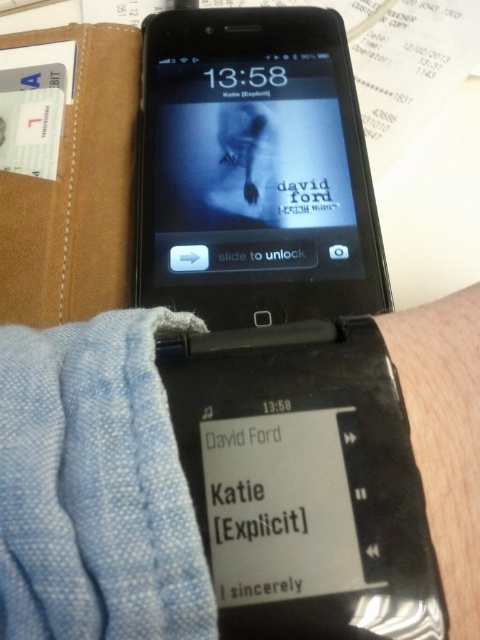
You are holding a black glossy smartphone at center and want to place it on a table next to a skinny silver bracelet at lower right. If the table is only 12 inches wide, will both items fit side by side without overlapping?

The black glossy smartphone at center and the skinny silver bracelet at lower right are 11.88 inches apart, so they can fit side by side on a 12 inch wide table since the total space needed is less than the table width.

You are holding a black glossy smartphone at center and want to place it next to a skinny silver bracelet at lower right on a small shelf. Given that the shelf has limited vertical space, will the smartphone fit vertically without overlapping the bracelet?

The black glossy smartphone at center is taller than the skinny silver bracelet at lower right, so it may not fit vertically on the shelf without overlapping if the shelf height is constrained.

You are holding the flip phone and want to check the time. Which object is closer to the top of the screen? The black glossy smartphone at center or the skinny silver bracelet at lower right?

The black glossy smartphone at center is above the skinny silver bracelet at lower right, so the black glossy smartphone at center is closer to the top of the screen.